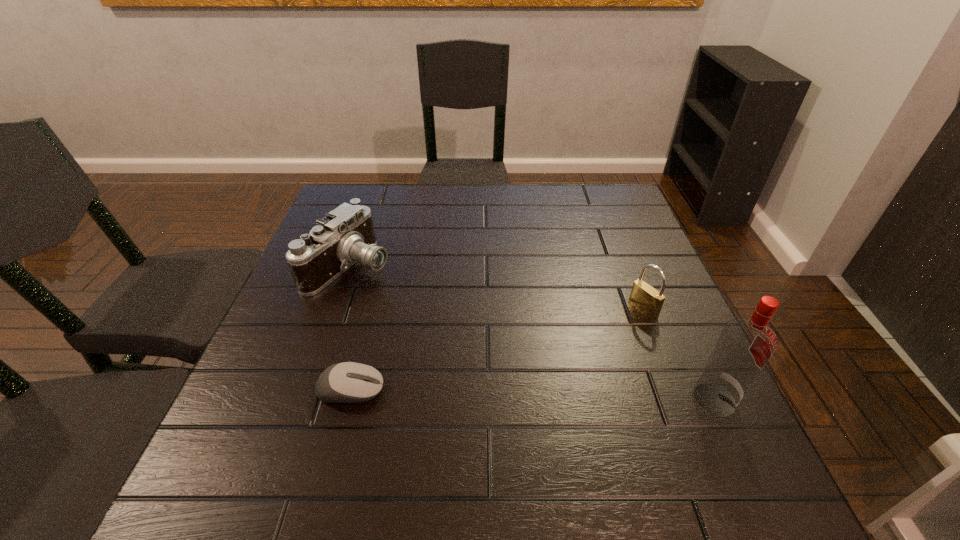
I want to click on vacant region that satisfies the following two spatial constraints: 1. on the front side of the third object from left to right; 2. on the front label of the tallest object, so click(x=678, y=399).

I want to click on vacant space that satisfies the following two spatial constraints: 1. on the front side of the camera; 2. on the right side of the padlock, so click(335, 309).

You are a GUI agent. You are given a task and a screenshot of the screen. Output one action in this format:
    pyautogui.click(x=<x>, y=<y>)
    Task: Click on the free location that satisfies the following two spatial constraints: 1. on the front side of the vodka; 2. on the front label of the farthest object
    The image size is (960, 540).
    Given the screenshot: What is the action you would take?
    pyautogui.click(x=304, y=399)